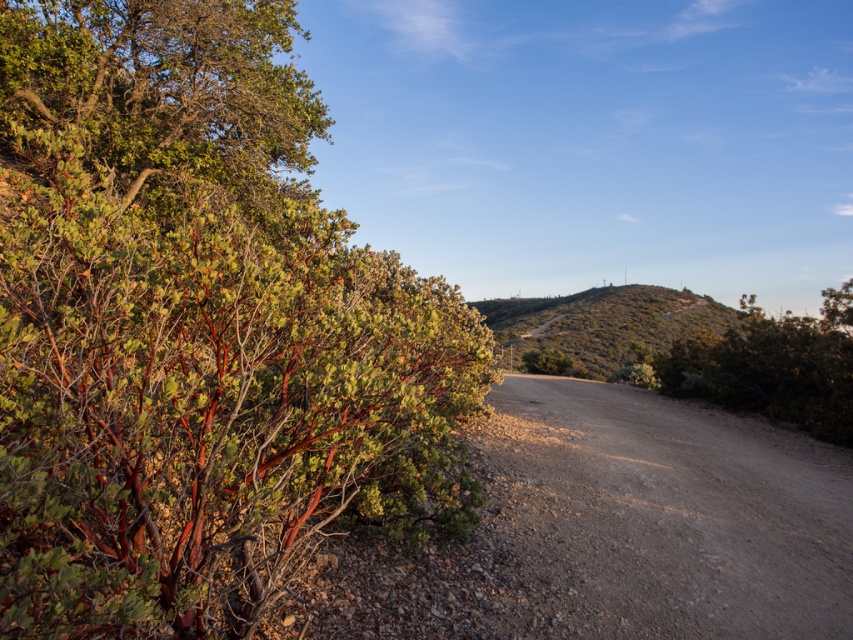
Question: Which is nearer to the green leafy bush at upper left?

Choices:
 (A) green matte bush at center
 (B) dusty gravel road at center
 (C) green shrubbery at center
 (D) matte reddish-brown shrub at left

Answer: (D)

Question: Is green shrubbery at center closer to camera compared to green matte bush at center?

Choices:
 (A) yes
 (B) no

Answer: (A)

Question: Which of these objects is positioned farthest from the green matte bush at center?

Choices:
 (A) matte reddish-brown shrub at left
 (B) green shrubbery at center
 (C) dusty gravel road at center
 (D) green leafy bush at upper left

Answer: (D)

Question: Does matte reddish-brown shrub at left appear on the right side of dusty gravel road at center?

Choices:
 (A) no
 (B) yes

Answer: (A)

Question: Observing the image, what is the correct spatial positioning of green leafy bush at upper left in reference to green matte bush at center?

Choices:
 (A) above
 (B) below

Answer: (A)

Question: Which point is farther to the camera?

Choices:
 (A) (80, 92)
 (B) (552, 364)
 (C) (486, 321)
 (D) (107, 584)

Answer: (C)